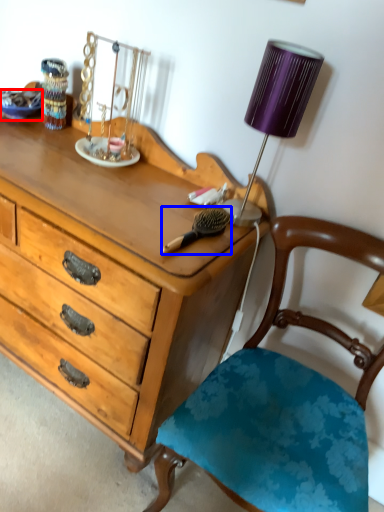
Question: Which point is further to the camera, plate (highlighted by a red box) or brush (highlighted by a blue box)?

Choices:
 (A) plate
 (B) brush

Answer: (A)